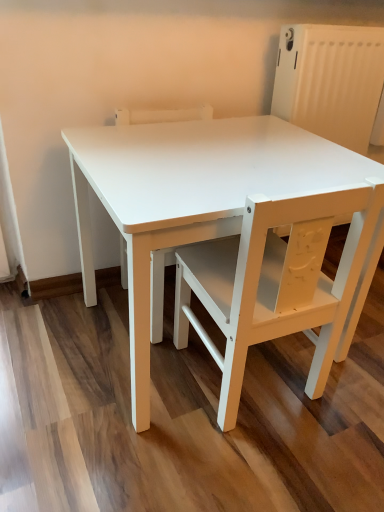
Question: Would you say white matte chair at center, which is counted as the 2th chair, starting from the right, is to the left or to the right of white matte chair at center, the 2th chair positioned from the left, in the picture?

Choices:
 (A) right
 (B) left

Answer: (B)

Question: Is point (155, 287) closer or farther from the camera than point (365, 287)?

Choices:
 (A) closer
 (B) farther

Answer: (B)

Question: From a real-world perspective, is white matte chair at center, arranged as the 1th chair when viewed from the left, above or below white matte chair at center, the 2th chair positioned from the left?

Choices:
 (A) below
 (B) above

Answer: (A)

Question: Is white matte chair at center, positioned as the first chair in right-to-left order, to the left or to the right of white matte chair at center, arranged as the 1th chair when viewed from the left, in the image?

Choices:
 (A) right
 (B) left

Answer: (A)

Question: From the image's perspective, is white matte chair at center, positioned as the first chair in right-to-left order, located above or below white matte chair at center, which is counted as the 2th chair, starting from the right?

Choices:
 (A) below
 (B) above

Answer: (A)

Question: In terms of height, does white matte chair at center, positioned as the first chair in right-to-left order, look taller or shorter compared to white matte chair at center, arranged as the 1th chair when viewed from the left?

Choices:
 (A) tall
 (B) short

Answer: (B)

Question: Based on their sizes in the image, would you say white matte chair at center, positioned as the first chair in right-to-left order, is bigger or smaller than white matte chair at center, which is counted as the 2th chair, starting from the right?

Choices:
 (A) big
 (B) small

Answer: (B)